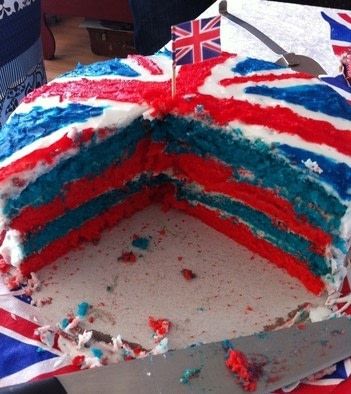
Identify the location of white plate. This screenshot has width=351, height=394. (93, 284).